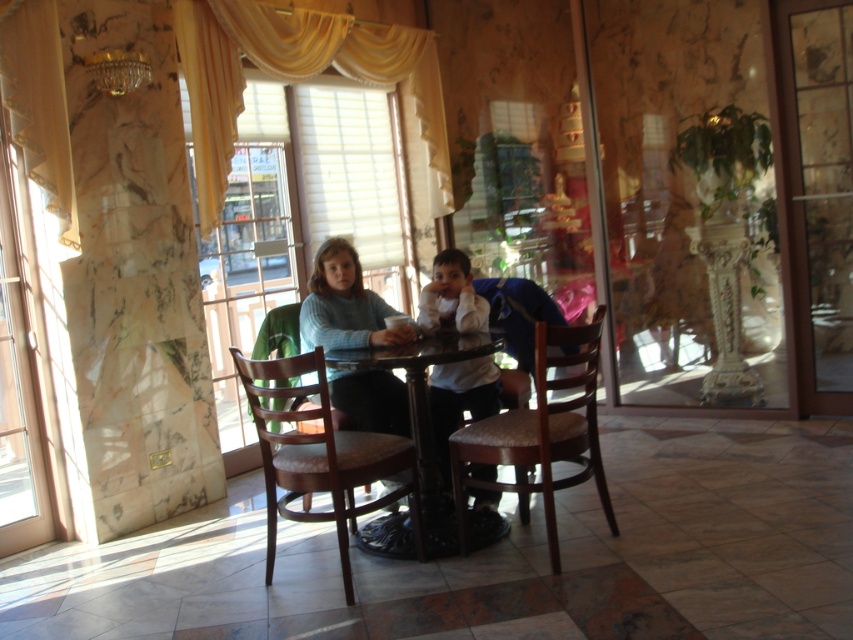
You are a photographer standing in the room and want to take a photo of the brown leather chair at center. If your camera has a minimum focus distance of 3 meters, will you be able to take a clear photo without moving closer?

The brown leather chair at center is 2.90 meters from the camera. Since the minimum focus distance is 3 meters, the camera cannot focus clearly at 2.90 meters. You need to move back to at least 3 meters away to take a clear photo.

Looking at this image, you are a person sitting in the brown leather chair at center. You want to hand a book to someone wearing the white matte shirt at center. Can you reach them without moving from your seat?

The brown leather chair at center is 26.00 inches away from white matte shirt at center, so yes, you can reach them since 26 inches is within typical reaching distance for handing an object.